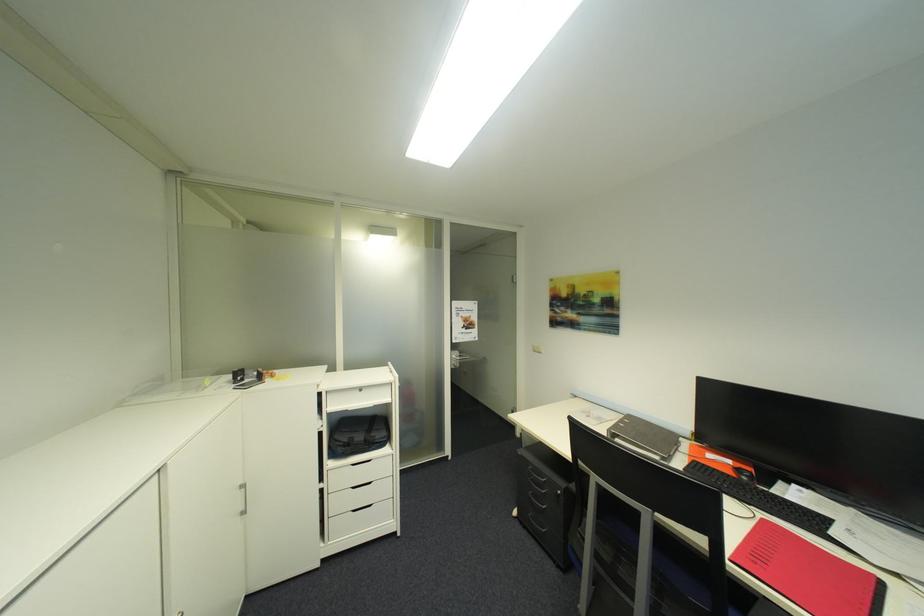
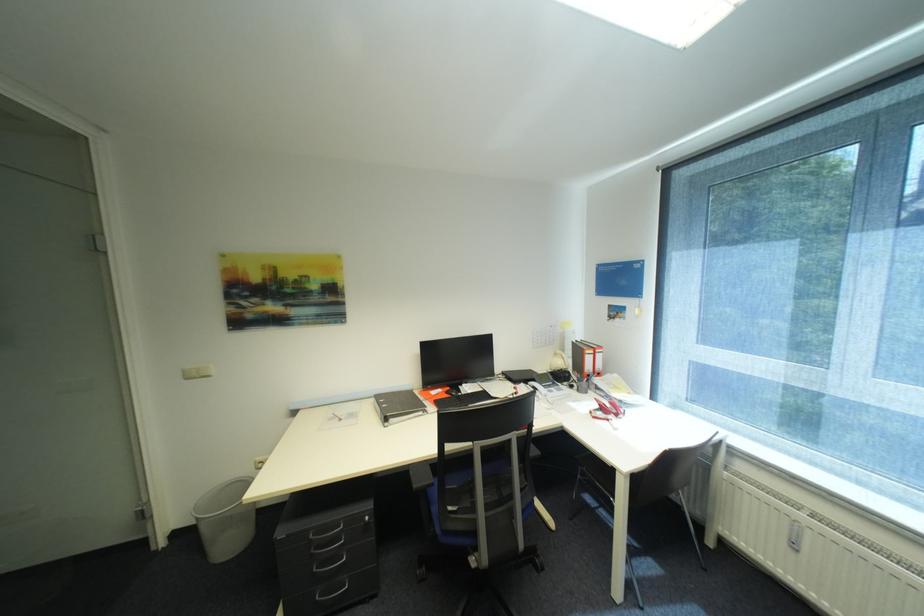
Question: The camera is either moving clockwise (left) or counter-clockwise (right) around the object. The first image is from the beginning of the video and the second image is from the end. Is the camera moving left or right when shooting the video?

Choices:
 (A) Left
 (B) Right

Answer: (A)